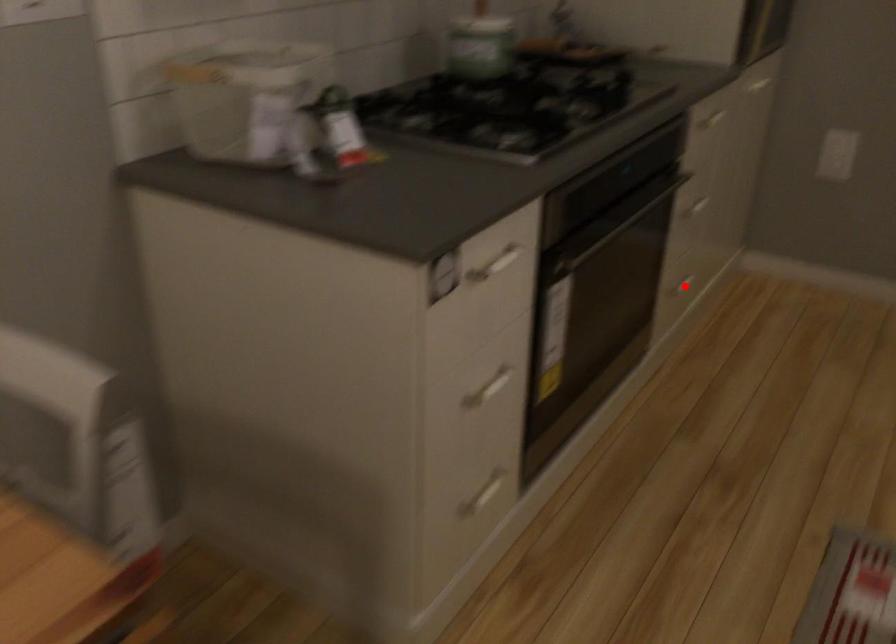
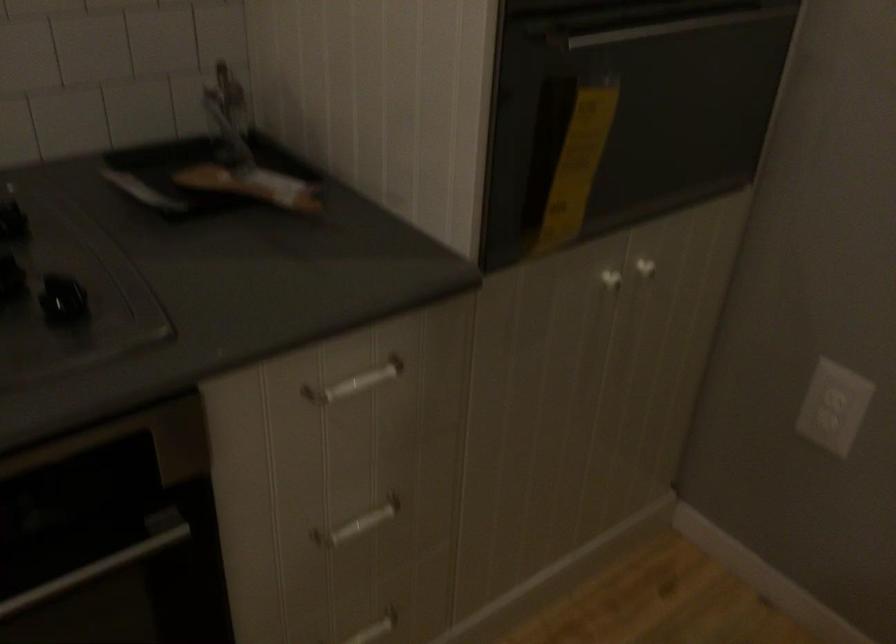
Locate, in the second image, the point that corresponds to the highlighted location in the first image.

(374, 629)